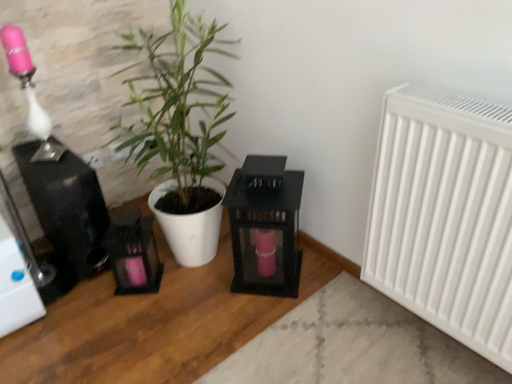
The image size is (512, 384). In order to click on free region on the left part of black glass lantern at center in this screenshot , I will do `click(201, 282)`.